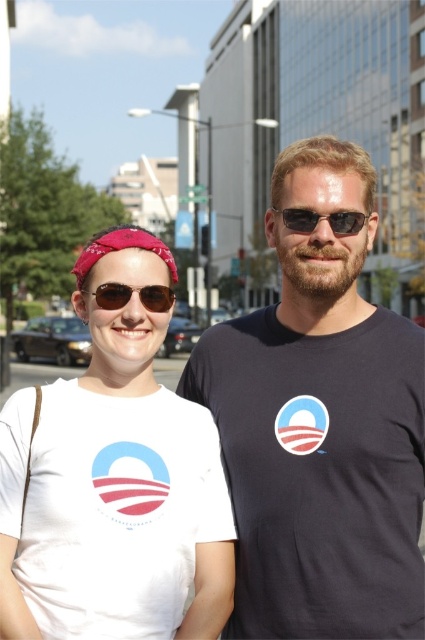
Which is more to the left, dark gray t-shirt at center or matte brown sunglasses at center?

matte brown sunglasses at center is more to the left.

The width and height of the screenshot is (425, 640). Find the location of `dark gray t-shirt at center`. dark gray t-shirt at center is located at coordinates (320, 424).

Who is more forward, (261,326) or (104,291)?

Point (104,291) is more forward.

This screenshot has width=425, height=640. I want to click on dark gray t-shirt at center, so click(x=320, y=424).

Can you confirm if dark gray t-shirt at center is positioned above sunglasses at center?

Incorrect, dark gray t-shirt at center is not positioned above sunglasses at center.

Is dark gray t-shirt at center in front of sunglasses at center?

Yes.

Who is more distant from viewer, (365,164) or (303,209)?

The point (365,164) is more distant.

The width and height of the screenshot is (425, 640). I want to click on dark gray t-shirt at center, so click(320, 424).

Does dark gray t-shirt at center appear under red bandana at center?

Yes.

Does point (319, 412) come farther from viewer compared to point (105, 244)?

Yes.

Which is in front, point (317, 372) or point (87, 268)?

Point (87, 268) is in front.

Where is `dark gray t-shirt at center`? dark gray t-shirt at center is located at coordinates (320, 424).